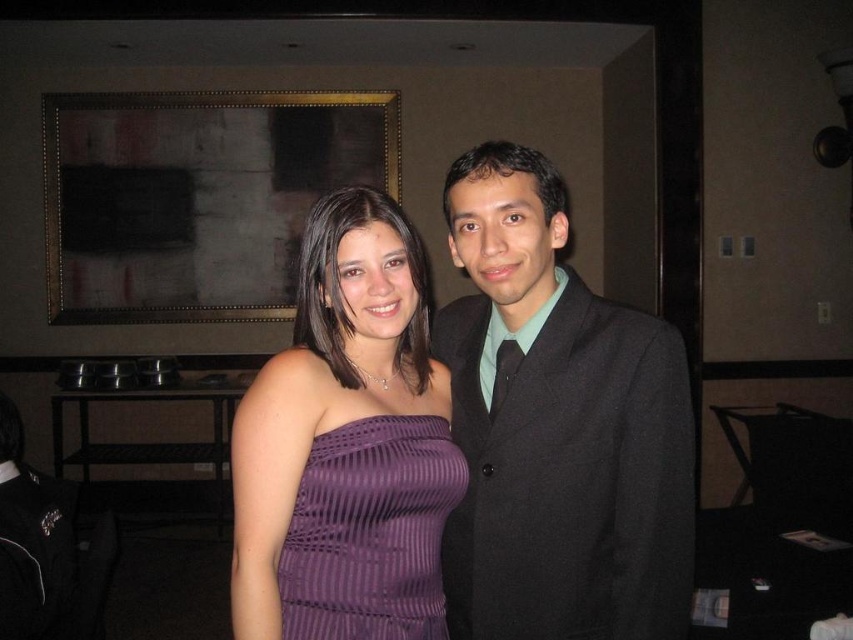
Question: Estimate the real-world distances between objects in this image. Which object is farther from the purple ribbed dress at center?

Choices:
 (A) purple striped dress at center
 (B) dark brown wooden picture frame at upper center

Answer: (B)

Question: Which point appears closest to the camera in this image?

Choices:
 (A) [407, 492]
 (B) [245, 419]
 (C) [554, 360]
 (D) [355, 160]

Answer: (B)

Question: Among these objects, which one is nearest to the camera?

Choices:
 (A) dark brown wooden picture frame at upper center
 (B) purple ribbed dress at center
 (C) matte black suit at center
 (D) purple striped dress at center

Answer: (B)

Question: Where is dark brown wooden picture frame at upper center located in relation to purple striped dress at center in the image?

Choices:
 (A) left
 (B) right

Answer: (A)

Question: Is purple ribbed dress at center to the right of purple striped dress at center from the viewer's perspective?

Choices:
 (A) yes
 (B) no

Answer: (B)

Question: Does purple ribbed dress at center have a smaller size compared to dark brown wooden picture frame at upper center?

Choices:
 (A) no
 (B) yes

Answer: (B)